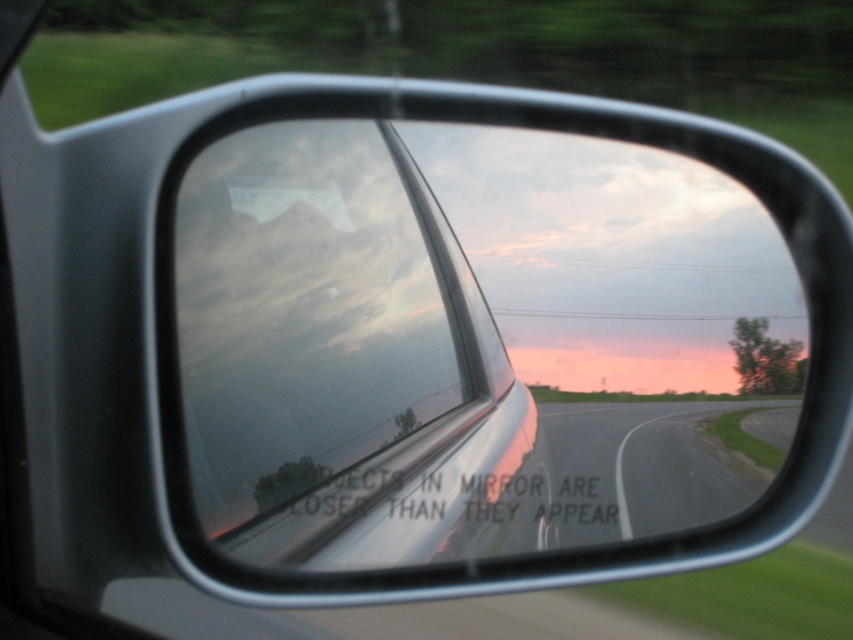
You are a passenger in the car and notice two points reflected in the side mirror. The first point is at coordinates point (218, 300) and the second is at point (647, 429). According to the warning on the mirror, which point appears closer to you in the reflection?

Point (218, 300) appears closer to the viewer than point (647, 429) because the warning on the mirror states that objects in the mirror are closer than they appear, and the description specifies that point (218, 300) is closer to the viewer.

Based on the scene described, where is the transparent glass car window at center located in terms of its 2D coordinates?

The transparent glass car window at center is located at the 2D coordinates point (341, 360).

You are a driver checking the car mirror to see the transparent glass car window at center and the asphalt road at center. Which object appears bigger in the mirror?

The transparent glass car window at center appears bigger in the mirror because it has a larger size compared to the asphalt road at center.